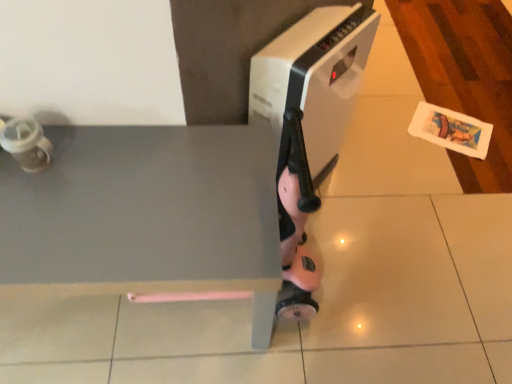
What do you see at coordinates (313, 79) in the screenshot? The width and height of the screenshot is (512, 384). I see `white plastic heater at center` at bounding box center [313, 79].

The width and height of the screenshot is (512, 384). Find the location of `matte gray table at lower left`. matte gray table at lower left is located at coordinates (144, 216).

What do you see at coordinates (384, 276) in the screenshot? The height and width of the screenshot is (384, 512). I see `matte gray tile at center` at bounding box center [384, 276].

The width and height of the screenshot is (512, 384). I want to click on matte gray tile at center, so click(x=384, y=276).

What are the coordinates of `white plastic heater at center` in the screenshot? It's located at (313, 79).

Can you tell me how much matte gray table at lower left and white plastic heater at center differ in facing direction?

There is a 48.5-degree angle between the facing directions of matte gray table at lower left and white plastic heater at center.

In terms of size, does matte gray table at lower left appear bigger or smaller than white plastic heater at center?

matte gray table at lower left is bigger than white plastic heater at center.

Which is correct: matte gray table at lower left is inside white plastic heater at center, or outside of it?

The correct answer is: outside.

From the image's perspective, which one is positioned higher, white plastic heater at center or matte gray tile at center?

white plastic heater at center is shown above in the image.

In terms of height, does white plastic heater at center look taller or shorter compared to matte gray tile at center?

white plastic heater at center is taller than matte gray tile at center.

Find the location of `home appliance above the matte gray tile at center (from the image's perspective)`. home appliance above the matte gray tile at center (from the image's perspective) is located at coordinates (313, 79).

Is white plastic heater at center inside the boundaries of matte gray tile at center, or outside?

white plastic heater at center is spatially situated outside matte gray tile at center.

Relative to matte gray table at lower left, is matte gray tile at center in front or behind?

Clearly, matte gray tile at center is behind matte gray table at lower left.

Is matte gray tile at center shorter than matte gray table at lower left?

Yes, matte gray tile at center is shorter than matte gray table at lower left.

Is matte gray tile at center to the left or to the right of matte gray table at lower left in the image?

matte gray tile at center is positioned on matte gray table at lower left's right side.

Where is `tile that is on the right side of matte gray table at lower left`? The image size is (512, 384). tile that is on the right side of matte gray table at lower left is located at coordinates (384, 276).

Between point (207, 222) and point (424, 242), which one is positioned in front?

The point (207, 222) is in front.

Could you tell me if matte gray table at lower left is facing matte gray tile at center?

No, matte gray table at lower left is not facing towards matte gray tile at center.

Is white plastic heater at center in front of or behind matte gray table at lower left in the image?

Clearly, white plastic heater at center is behind matte gray table at lower left.

Considering the relative sizes of white plastic heater at center and matte gray table at lower left in the image provided, is white plastic heater at center bigger than matte gray table at lower left?

Actually, white plastic heater at center might be smaller than matte gray table at lower left.

From a real-world perspective, is white plastic heater at center on top of matte gray table at lower left?

Yes.

Considering the sizes of objects matte gray tile at center and white plastic heater at center in the image provided, who is wider, matte gray tile at center or white plastic heater at center?

matte gray tile at center is wider.

Is matte gray tile at center facing away from white plastic heater at center?

No.

Does matte gray tile at center have a larger size compared to white plastic heater at center?

Yes.

Is white plastic heater at center a part of matte gray tile at center?

No, white plastic heater at center is not surrounded by matte gray tile at center.

The image size is (512, 384). In order to click on home appliance above the matte gray table at lower left (from the image's perspective) in this screenshot , I will do `click(313, 79)`.

At what (x,y) coordinates should I click in order to perform the action: click on tile that appears behind the white plastic heater at center. Please return your answer as a coordinate pair (x, y). This screenshot has height=384, width=512. Looking at the image, I should click on (384, 276).

Based on their spatial positions, is matte gray table at lower left or matte gray tile at center further from white plastic heater at center?

matte gray tile at center is positioned further to the anchor white plastic heater at center.

Which object lies nearer to the anchor point matte gray table at lower left, matte gray tile at center or white plastic heater at center?

white plastic heater at center is closer to matte gray table at lower left.

Considering their positions, is matte gray tile at center positioned closer to white plastic heater at center than matte gray table at lower left?

matte gray table at lower left is positioned closer to the anchor white plastic heater at center.

Which object lies further to the anchor point matte gray tile at center, matte gray table at lower left or white plastic heater at center?

Result: white plastic heater at center is positioned further to the anchor matte gray tile at center.

When comparing their distances from matte gray table at lower left, does white plastic heater at center or matte gray tile at center seem further?

Based on the image, matte gray tile at center appears to be further to matte gray table at lower left.

Considering their positions, is white plastic heater at center positioned further to matte gray tile at center than matte gray table at lower left?

white plastic heater at center lies further to matte gray tile at center than the other object.

Locate an element on the screen. Image resolution: width=512 pixels, height=384 pixels. tile located between matte gray table at lower left and white plastic heater at center in the left-right direction is located at coordinates (384, 276).